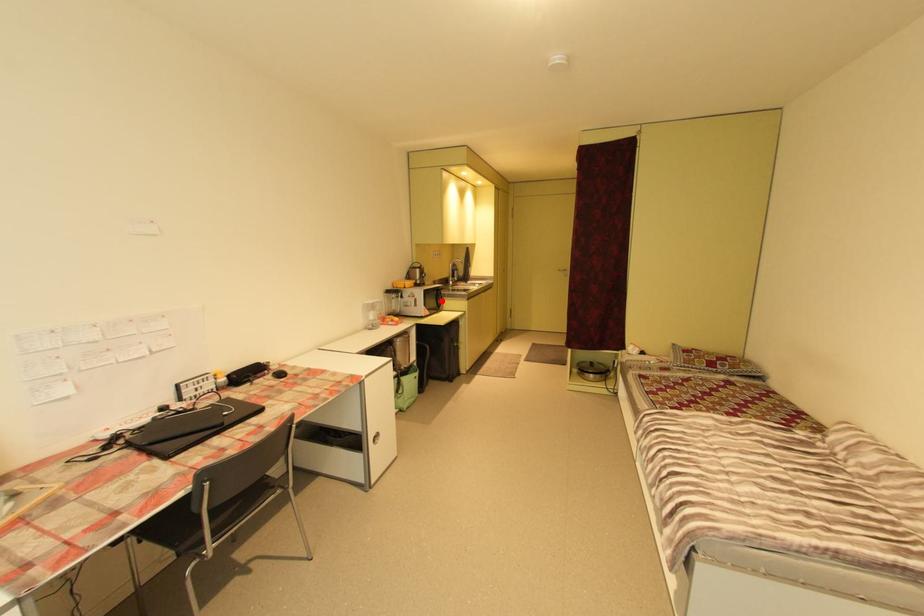
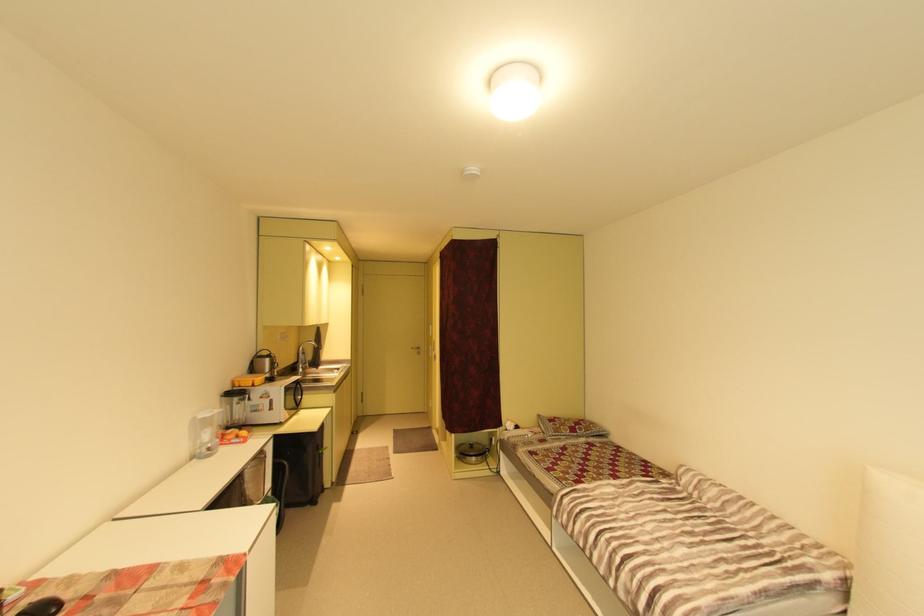
Find the pixel in the second image that matches the highlighted location in the first image.

(299, 398)